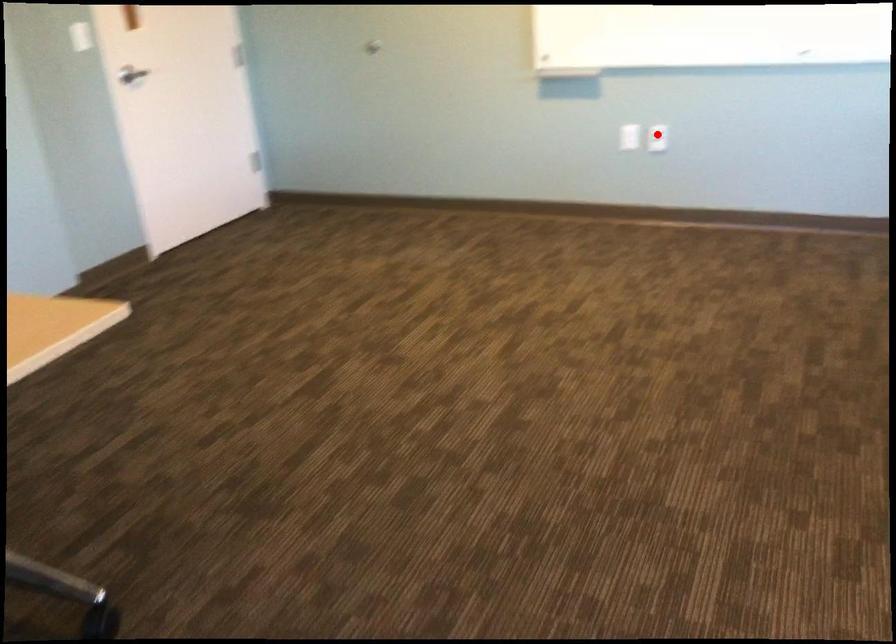
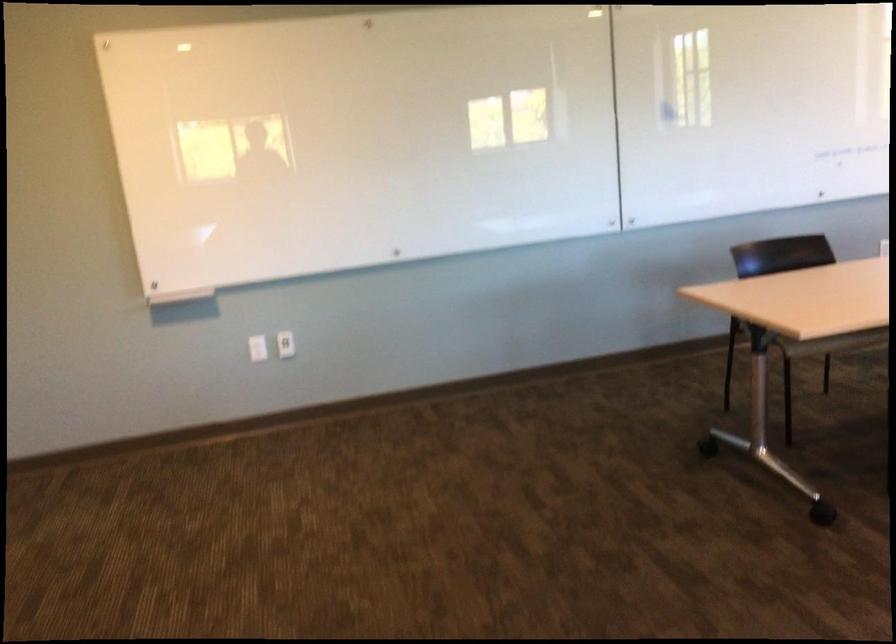
The point at the highlighted location is marked in the first image. Where is the corresponding point in the second image?

(286, 344)